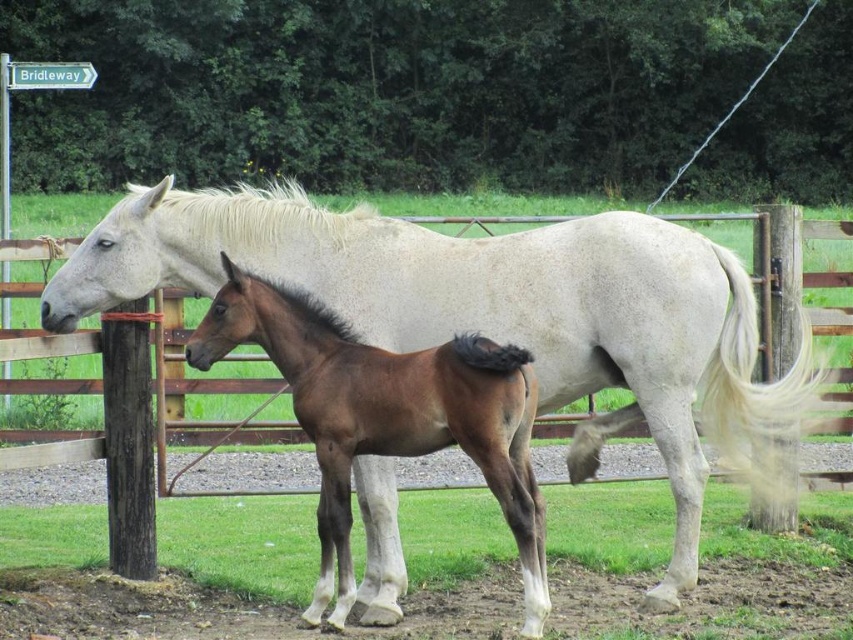
You are a photographer standing in the middle of the paddock, and you want to take a photo of both the larger horse and the smaller horse. You notice two points marked in the scene. The first point is at coordinate point (659, 348) and the second point is at coordinate point (270, 312). Which point is closer to you, the photographer?

Point (270, 312) is closer to you because the description states that point (659, 348) is further to the viewer than point (270, 312).

You are a photographer positioned at the front of the paddock trying to capture both the white matte horse at center and the brown glossy horse at center in a single frame. Can you adjust your position so that both horses are fully visible without any part of either horse being blocked by the fence or each other?

The brown glossy horse at center is behind the white matte horse at center, so adjusting your position to the side would allow both horses to be fully visible without obstruction.